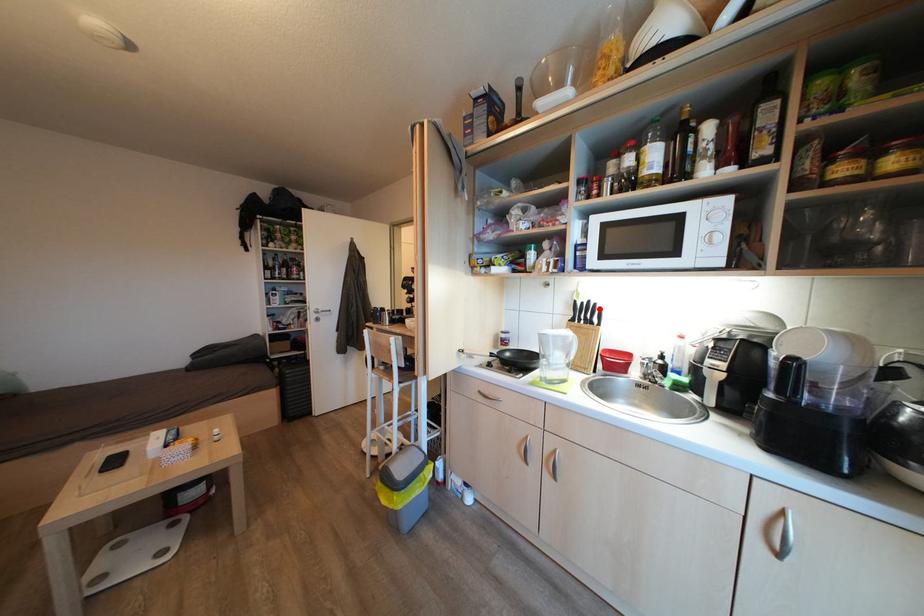
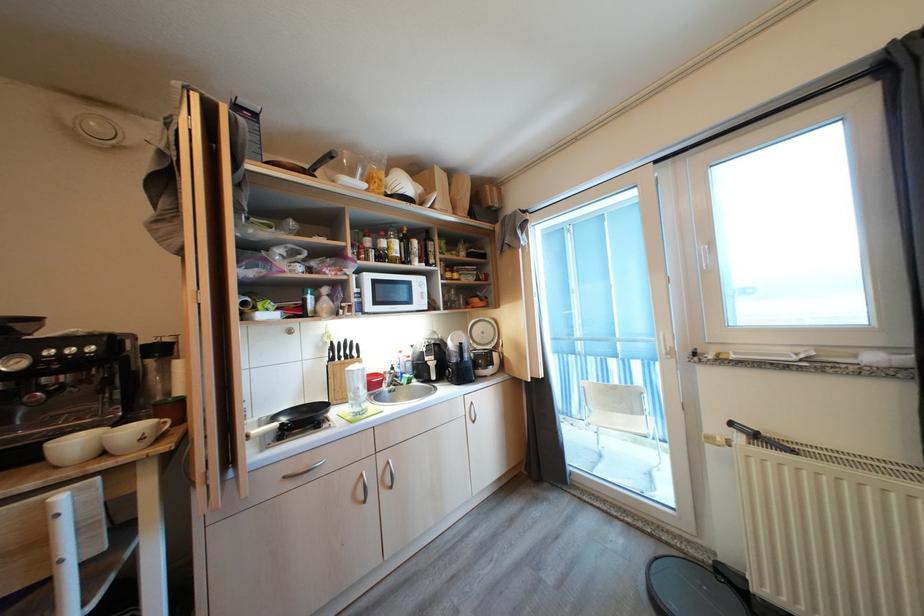
Locate, in the second image, the point that corresponds to the highlighted location in the first image.

(357, 346)